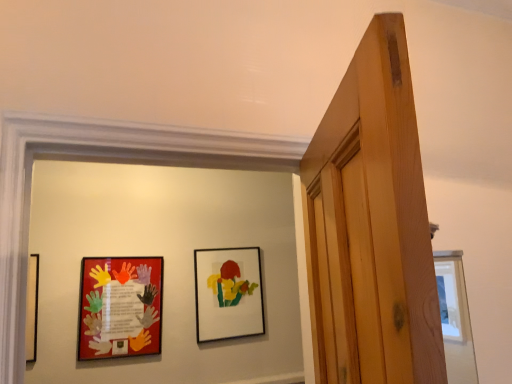
Question: From the image's perspective, is matte plastic picture frame at left, which ranks as the 2th picture frame in back-to-front order, on top of matte black picture frame at center, marked as the 1th picture frame in a back-to-front arrangement?

Choices:
 (A) no
 (B) yes

Answer: (A)

Question: Is matte plastic picture frame at left, which ranks as the 2th picture frame in back-to-front order, beside matte black picture frame at center, the 2th picture frame from the front?

Choices:
 (A) no
 (B) yes

Answer: (A)

Question: Is matte plastic picture frame at left, the 1th picture frame positioned from the left, outside of matte black picture frame at center, marked as the 1th picture frame in a back-to-front arrangement?

Choices:
 (A) no
 (B) yes

Answer: (B)

Question: Can you confirm if matte plastic picture frame at left, which ranks as the 2th picture frame in back-to-front order, is wider than matte black picture frame at center, marked as the 1th picture frame in a back-to-front arrangement?

Choices:
 (A) yes
 (B) no

Answer: (B)

Question: Is matte plastic picture frame at left, the first picture frame in the front-to-back sequence, positioned in front of matte black picture frame at center, the 2th picture frame from the front?

Choices:
 (A) no
 (B) yes

Answer: (B)

Question: Is matte plastic picture frame at left, the 1th picture frame positioned from the left, taller than matte black picture frame at center, marked as the 1th picture frame in a back-to-front arrangement?

Choices:
 (A) no
 (B) yes

Answer: (A)

Question: Is matte black picture frame at center, arranged as the first picture frame when viewed from the right, not within matte plastic picture frame at left, the first picture frame in the front-to-back sequence?

Choices:
 (A) no
 (B) yes

Answer: (B)

Question: Considering the relative sizes of matte black picture frame at center, the 2th picture frame from the front, and matte plastic picture frame at left, which is counted as the second picture frame, starting from the right, in the image provided, is matte black picture frame at center, the 2th picture frame from the front, bigger than matte plastic picture frame at left, which is counted as the second picture frame, starting from the right,?

Choices:
 (A) no
 (B) yes

Answer: (B)

Question: Is the depth of matte black picture frame at center, the 2th picture frame from the front, less than that of matte plastic picture frame at left, the first picture frame in the front-to-back sequence?

Choices:
 (A) yes
 (B) no

Answer: (B)

Question: Does matte black picture frame at center, marked as the 1th picture frame in a back-to-front arrangement, have a smaller size compared to matte plastic picture frame at left, which is counted as the second picture frame, starting from the right?

Choices:
 (A) yes
 (B) no

Answer: (B)

Question: Does matte black picture frame at center, arranged as the first picture frame when viewed from the right, touch matte plastic picture frame at left, which ranks as the 2th picture frame in back-to-front order?

Choices:
 (A) yes
 (B) no

Answer: (B)

Question: Is matte black picture frame at center, placed as the 2th picture frame when sorted from left to right, wider than matte plastic picture frame at left, the first picture frame in the front-to-back sequence?

Choices:
 (A) no
 (B) yes

Answer: (B)

Question: From a real-world perspective, relative to matte plastic picture frame at left, which is counted as the second picture frame, starting from the right, is matte black picture frame at center, marked as the 1th picture frame in a back-to-front arrangement, vertically above or below?

Choices:
 (A) below
 (B) above

Answer: (B)